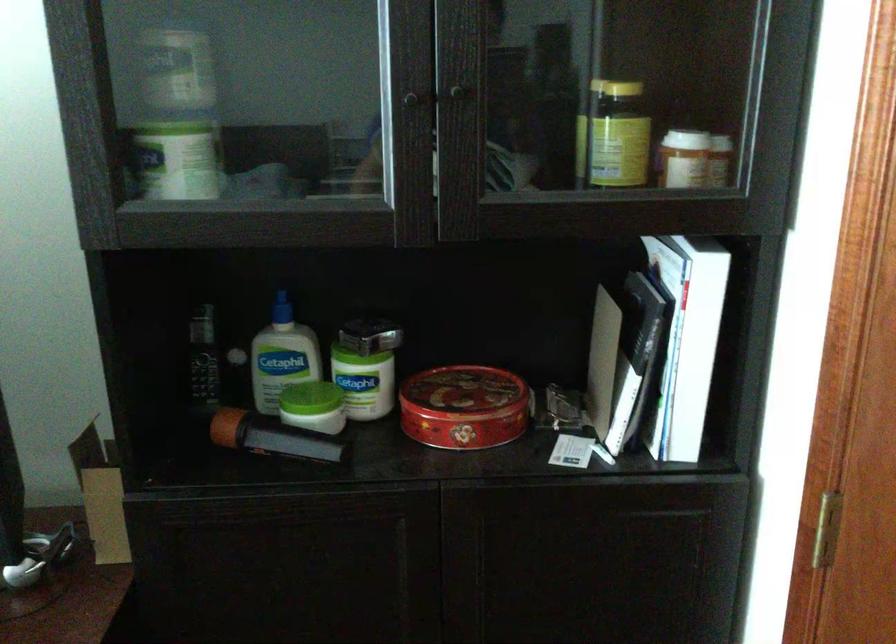
Find the location of a particular element. Image resolution: width=896 pixels, height=644 pixels. red tin lid is located at coordinates (462, 393).